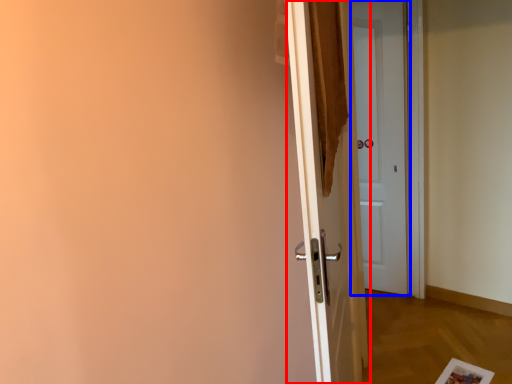
Question: Which object appears closest to the camera in this image, door (highlighted by a red box) or door (highlighted by a blue box)?

Choices:
 (A) door
 (B) door

Answer: (A)